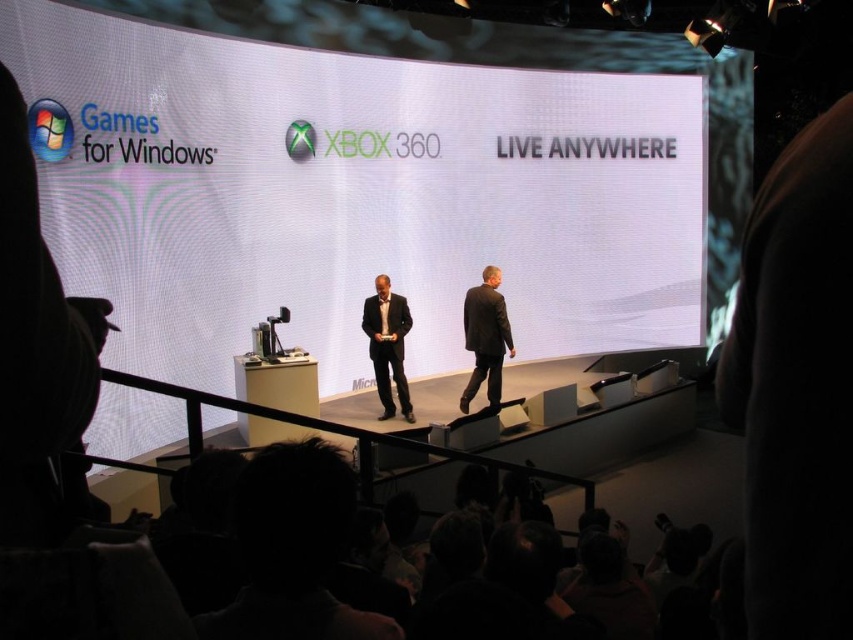
Question: Is white matte projection screen at upper center positioned before black suit at center?

Choices:
 (A) yes
 (B) no

Answer: (A)

Question: Which of these objects is positioned closest to the dark gray suit at center?

Choices:
 (A) white matte projection screen at upper center
 (B) black suit at center

Answer: (B)

Question: Which point is farther to the camera?

Choices:
 (A) black suit at center
 (B) dark gray suit at center

Answer: (B)

Question: In this image, where is white matte projection screen at upper center located relative to dark gray suit at center?

Choices:
 (A) below
 (B) above

Answer: (B)

Question: Can you confirm if dark gray suit at center is wider than black suit at center?

Choices:
 (A) no
 (B) yes

Answer: (B)

Question: Among these points, which one is nearest to the camera?

Choices:
 (A) (334, 349)
 (B) (479, 352)

Answer: (B)